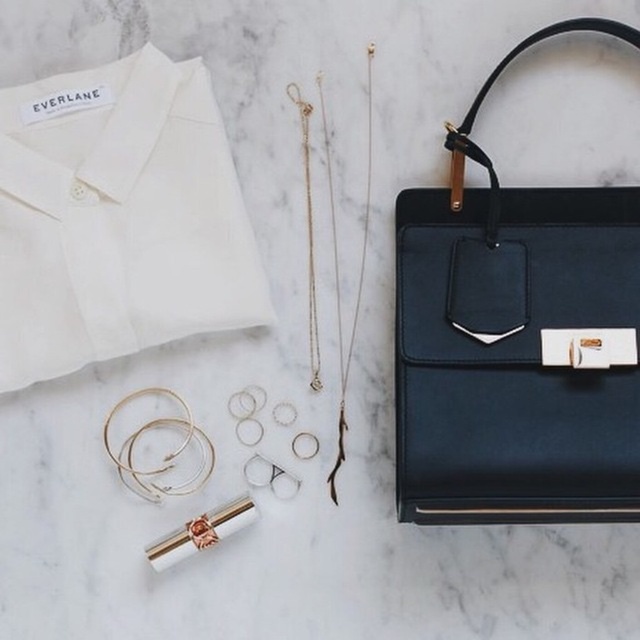
Question: Is white cotton dress shirt at upper left to the left of metallic gold cigarette at lower left from the viewer's perspective?

Choices:
 (A) no
 (B) yes

Answer: (B)

Question: Is matte black leather handbag at right smaller than metallic gold cigarette at lower left?

Choices:
 (A) yes
 (B) no

Answer: (B)

Question: Which point is closer to the camera taking this photo?

Choices:
 (A) coord(634,301)
 (B) coord(140,184)

Answer: (A)

Question: Which object is the farthest from the white cotton dress shirt at upper left?

Choices:
 (A) matte black leather handbag at right
 (B) metallic gold cigarette at lower left

Answer: (A)

Question: Which of the following is the farthest from the observer?

Choices:
 (A) matte black leather handbag at right
 (B) white cotton dress shirt at upper left
 (C) metallic gold cigarette at lower left

Answer: (C)

Question: Does matte black leather handbag at right appear over metallic gold cigarette at lower left?

Choices:
 (A) no
 (B) yes

Answer: (B)